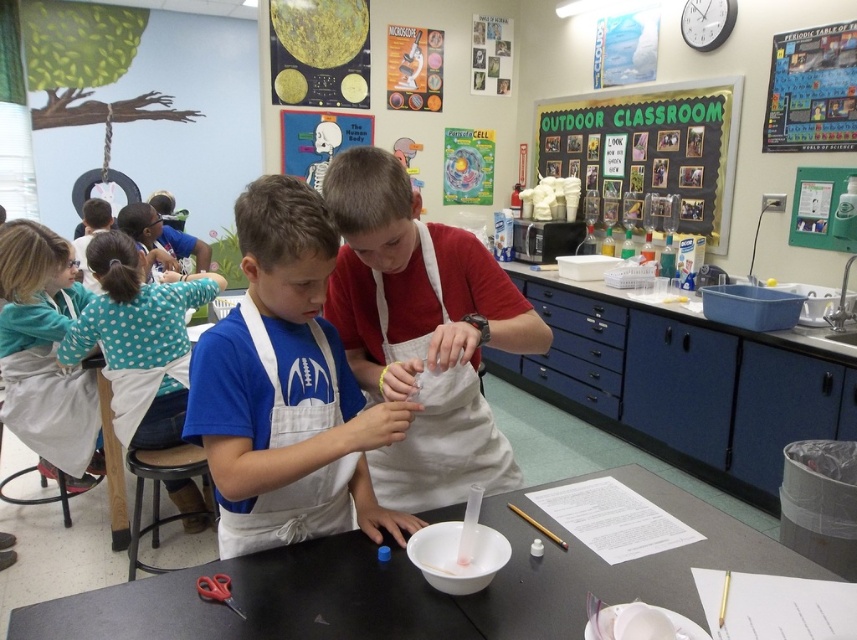
You are a student in the outdoor classroom and need to decide which item has a wider width between the white apron at left and the green chalkboard at upper center. Which one is wider?

The green chalkboard at upper center is wider than the white apron at left.

You are a teacher in the outdoor classroom and notice two students wearing the teal polka dot shirt at upper left and the white apron at left. Which student is positioned to the right of the other?

The teal polka dot shirt at upper left is positioned to the right of the white apron at left.

You are standing in the Outdoor Classroom and want to place a small plant on the black matte table at center. Given that the table is at coordinates point (417, 586), can you confirm the table is indeed at the center of the room?

The point (417, 586) corresponds to the black matte table at center, so yes, the table is at the center of the room.